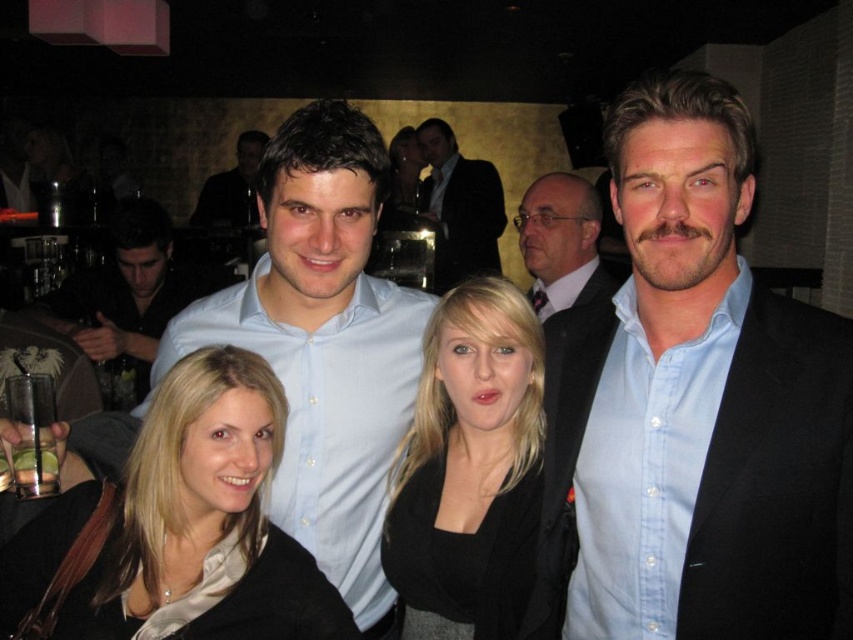
Who is higher up, matte light blue shirt at center or dark suit at center?

dark suit at center

You are a GUI agent. You are given a task and a screenshot of the screen. Output one action in this format:
    pyautogui.click(x=<x>, y=<y>)
    Task: Click on the matte light blue shirt at center
    This screenshot has width=853, height=640.
    Given the screenshot: What is the action you would take?
    coord(323,344)

This screenshot has height=640, width=853. What do you see at coordinates (323, 344) in the screenshot? I see `matte light blue shirt at center` at bounding box center [323, 344].

Identify the location of matte light blue shirt at center. This screenshot has width=853, height=640. (323, 344).

Can you confirm if matte black jacket at lower left is wider than dark suit at center?

No, matte black jacket at lower left is not wider than dark suit at center.

Between point (260, 600) and point (492, 180), which one is positioned in front?

Point (260, 600) is in front.

This screenshot has width=853, height=640. What are the coordinates of `matte black jacket at lower left` in the screenshot? It's located at (177, 529).

Which is behind, point (535, 282) or point (251, 134)?

The point (251, 134) is more distant.

Is matte black suit at upper center above light blue shirt at center?

Actually, matte black suit at upper center is below light blue shirt at center.

Between point (540, 253) and point (242, 186), which one is positioned behind?

Point (242, 186)

Where is `matte black suit at upper center`? The height and width of the screenshot is (640, 853). matte black suit at upper center is located at coordinates (x=561, y=243).